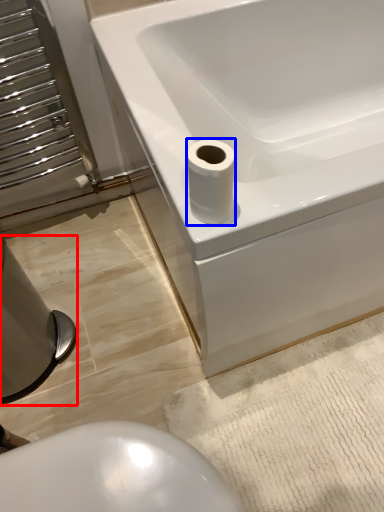
Question: Among these objects, which one is nearest to the camera, bidet (highlighted by a red box) or toilet paper (highlighted by a blue box)?

Choices:
 (A) bidet
 (B) toilet paper

Answer: (B)